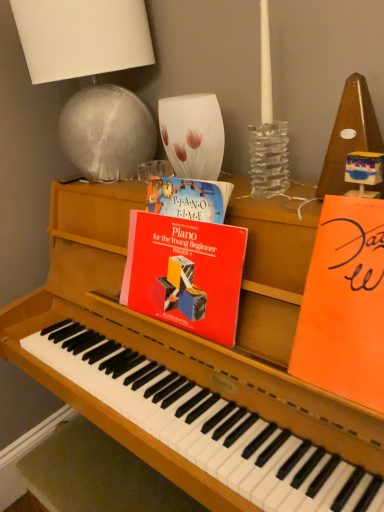
Question: Relative to orange matte paper at right, which is counted as the 1th paperback book, starting from the right, is red matte piano book at center, marked as the first paperback book in a left-to-right arrangement, in front or behind?

Choices:
 (A) front
 (B) behind

Answer: (B)

Question: Based on their sizes in the image, would you say red matte piano book at center, which is the second paperback book in right-to-left order, is bigger or smaller than orange matte paper at right, placed as the second paperback book when sorted from left to right?

Choices:
 (A) small
 (B) big

Answer: (B)

Question: Which object is the closest to the white fabric lampshade at upper left?

Choices:
 (A) orange matte paper at right, placed as the second paperback book when sorted from left to right
 (B) red matte piano book at center, marked as the first paperback book in a left-to-right arrangement

Answer: (B)

Question: Which of these objects is positioned farthest from the red matte piano book at center, which is the second paperback book in right-to-left order?

Choices:
 (A) orange matte paper at right, which is counted as the 1th paperback book, starting from the right
 (B) white fabric lampshade at upper left

Answer: (B)